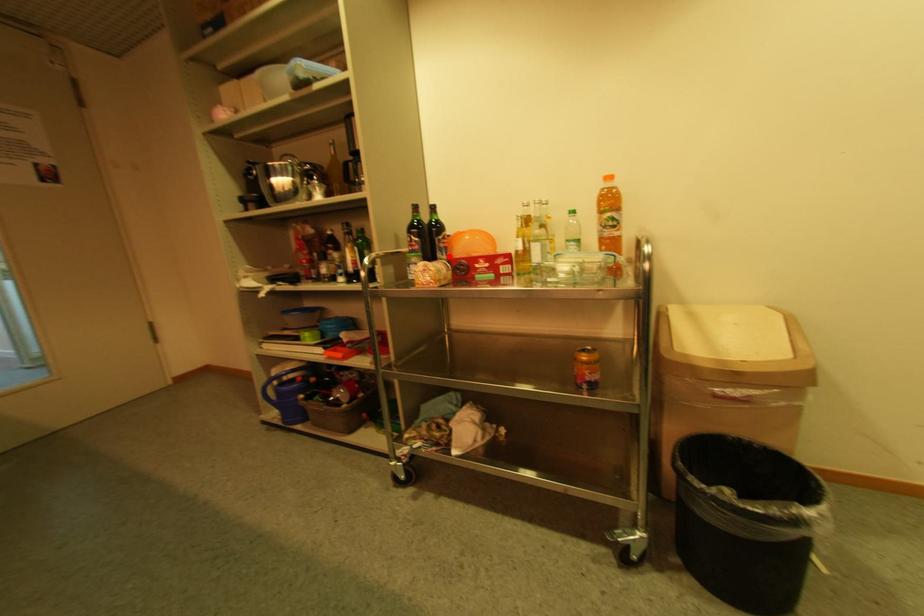
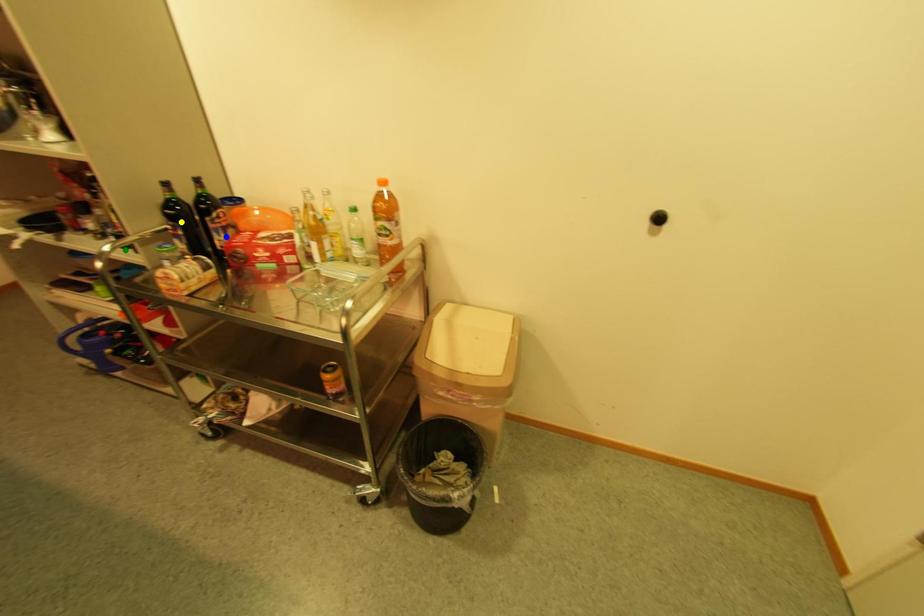
Question: I am providing you with two images of the same scene from different viewpoints. A red point is marked on the first image. You are given multiple points on the second image. Which spot in image 2 lines up with the point in image 1?

Choices:
 (A) green point
 (B) yellow point
 (C) blue point

Answer: (C)